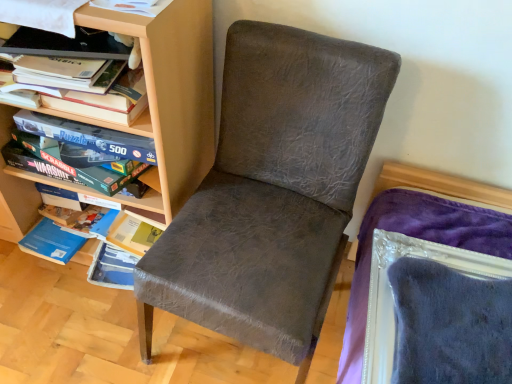
Question: Should I look upward or downward to see matte wood shelf at left?

Choices:
 (A) down
 (B) up

Answer: (B)

Question: Can you confirm if matte gray chair at center is taller than hardcover book at upper left?

Choices:
 (A) no
 (B) yes

Answer: (B)

Question: Is matte gray chair at center aimed at hardcover book at upper left?

Choices:
 (A) no
 (B) yes

Answer: (A)

Question: Is the surface of matte gray chair at center in direct contact with hardcover book at upper left?

Choices:
 (A) no
 (B) yes

Answer: (A)

Question: From a real-world perspective, is matte gray chair at center positioned over hardcover book at upper left based on gravity?

Choices:
 (A) yes
 (B) no

Answer: (B)

Question: Is hardcover book at upper left inside matte gray chair at center?

Choices:
 (A) yes
 (B) no

Answer: (B)

Question: Considering the relative sizes of matte gray chair at center and hardcover book at upper left in the image provided, is matte gray chair at center thinner than hardcover book at upper left?

Choices:
 (A) yes
 (B) no

Answer: (B)

Question: Is matte wood shelf at left at the right side of hardcover book at upper left?

Choices:
 (A) no
 (B) yes

Answer: (A)

Question: Is matte wood shelf at left behind hardcover book at upper left?

Choices:
 (A) yes
 (B) no

Answer: (B)

Question: Can you confirm if matte wood shelf at left is shorter than hardcover book at upper left?

Choices:
 (A) no
 (B) yes

Answer: (A)

Question: Is matte wood shelf at left wider than hardcover book at upper left?

Choices:
 (A) yes
 (B) no

Answer: (A)

Question: Are matte wood shelf at left and hardcover book at upper left located far from each other?

Choices:
 (A) no
 (B) yes

Answer: (A)

Question: From the image's perspective, is matte wood shelf at left below hardcover book at upper left?

Choices:
 (A) no
 (B) yes

Answer: (B)

Question: Considering the relative sizes of matte wood shelf at left and matte gray chair at center in the image provided, is matte wood shelf at left taller than matte gray chair at center?

Choices:
 (A) no
 (B) yes

Answer: (B)